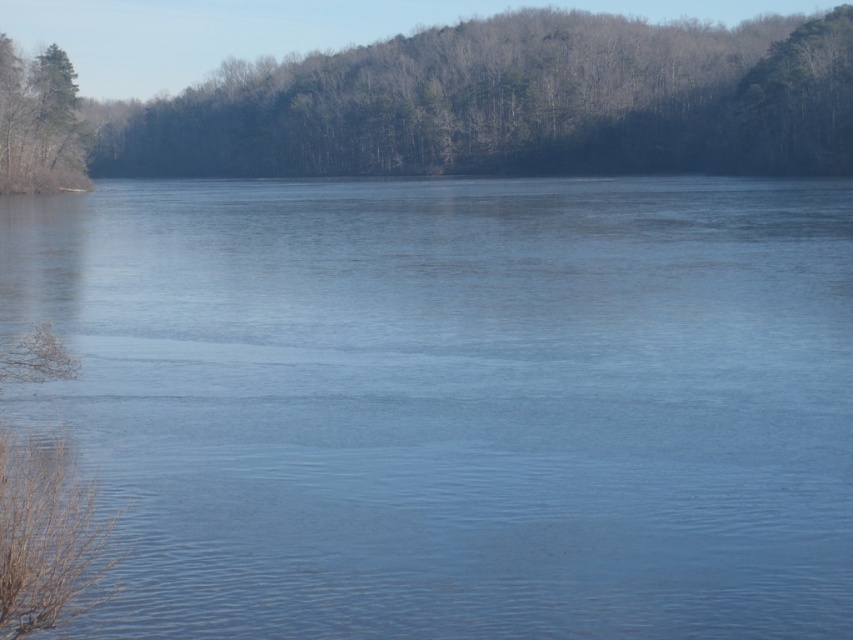
Question: Is green leafy trees at upper center positioned at the back of green matte tree at upper left?

Choices:
 (A) yes
 (B) no

Answer: (A)

Question: Which of these objects is positioned farthest from the green leafy trees at upper center?

Choices:
 (A) blue water at center
 (B) green matte tree at upper left

Answer: (A)

Question: Which of the following is the farthest from the observer?

Choices:
 (A) blue water at center
 (B) green leafy trees at upper center
 (C) green matte tree at upper left

Answer: (B)

Question: Can you confirm if green leafy trees at upper center is wider than green matte tree at upper left?

Choices:
 (A) yes
 (B) no

Answer: (A)

Question: Does blue water at center have a lesser width compared to green matte tree at upper left?

Choices:
 (A) yes
 (B) no

Answer: (B)

Question: Which point appears farthest from the camera in this image?

Choices:
 (A) (695, 492)
 (B) (305, 170)
 (C) (7, 76)

Answer: (B)